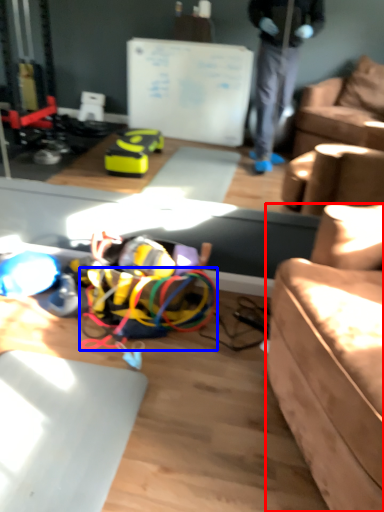
Question: Which of the following is the farthest to the observer, studio couch (highlighted by a red box) or wire (highlighted by a blue box)?

Choices:
 (A) studio couch
 (B) wire

Answer: (B)